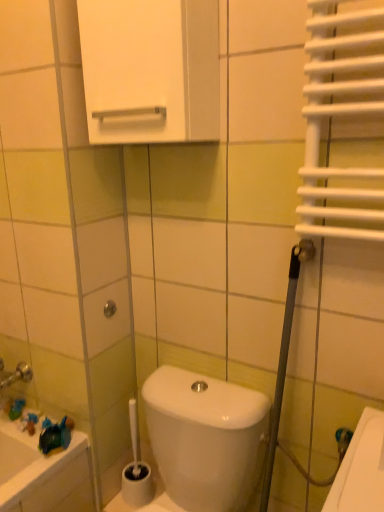
Question: Is white plastic toilet brush at lower center to the left of metallic silver shower at center from the viewer's perspective?

Choices:
 (A) no
 (B) yes

Answer: (A)

Question: From the image's perspective, does white plastic toilet brush at lower center appear lower than metallic silver shower at center?

Choices:
 (A) yes
 (B) no

Answer: (A)

Question: Does white plastic toilet brush at lower center lie behind metallic silver shower at center?

Choices:
 (A) no
 (B) yes

Answer: (A)

Question: Is white plastic toilet brush at lower center outside of metallic silver shower at center?

Choices:
 (A) no
 (B) yes

Answer: (B)

Question: Can you confirm if white plastic toilet brush at lower center is taller than metallic silver shower at center?

Choices:
 (A) yes
 (B) no

Answer: (A)

Question: Considering the positions of metallic silver shower at center and white plastic toilet brush at lower center in the image, is metallic silver shower at center taller or shorter than white plastic toilet brush at lower center?

Choices:
 (A) short
 (B) tall

Answer: (A)

Question: Looking at the image, does metallic silver shower at center seem bigger or smaller compared to white plastic toilet brush at lower center?

Choices:
 (A) small
 (B) big

Answer: (A)

Question: Would you say metallic silver shower at center is inside or outside white plastic toilet brush at lower center?

Choices:
 (A) outside
 (B) inside

Answer: (A)

Question: From a real-world perspective, is metallic silver shower at center physically located above or below white plastic toilet brush at lower center?

Choices:
 (A) below
 (B) above

Answer: (B)

Question: Based on their sizes in the image, would you say white plastic toilet brush at lower center is bigger or smaller than metallic silver shower at center?

Choices:
 (A) small
 (B) big

Answer: (B)

Question: Choose the correct answer: Is white plastic toilet brush at lower center inside metallic silver shower at center or outside it?

Choices:
 (A) outside
 (B) inside

Answer: (A)

Question: Would you say white plastic toilet brush at lower center is to the left or to the right of metallic silver shower at center in the picture?

Choices:
 (A) right
 (B) left

Answer: (A)

Question: Relative to metallic silver shower at center, is white plastic toilet brush at lower center in front or behind?

Choices:
 (A) behind
 (B) front

Answer: (B)

Question: From the image's perspective, relative to metallic silver shower at center, is white glossy cabinet at upper center above or below?

Choices:
 (A) below
 (B) above

Answer: (B)

Question: Choose the correct answer: Is white glossy cabinet at upper center inside metallic silver shower at center or outside it?

Choices:
 (A) inside
 (B) outside

Answer: (B)